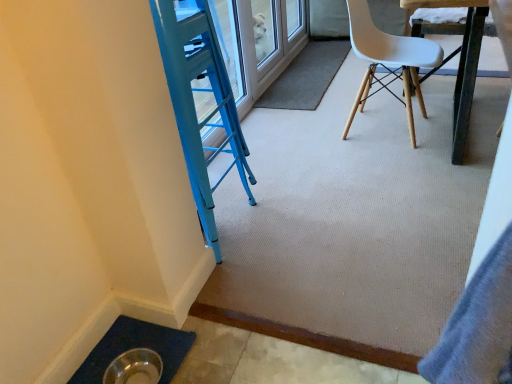
The width and height of the screenshot is (512, 384). Describe the element at coordinates (459, 62) in the screenshot. I see `metallic dark brown table at upper right` at that location.

I want to click on white plastic chair at upper right, so click(389, 60).

Considering the relative positions of metallic dark brown table at upper right and carpet at center in the image provided, is metallic dark brown table at upper right to the right of carpet at center from the viewer's perspective?

Indeed, metallic dark brown table at upper right is positioned on the right side of carpet at center.

You are a GUI agent. You are given a task and a screenshot of the screen. Output one action in this format:
    pyautogui.click(x=<x>, y=<y>)
    Task: Click on the table that is below the carpet at center (from the image's perspective)
    
    Given the screenshot: What is the action you would take?
    pyautogui.click(x=459, y=62)

Considering the positions of point (471, 44) and point (337, 68), is point (471, 44) closer or farther from the camera than point (337, 68)?

Point (471, 44) appears to be closer to the viewer than point (337, 68).

Who is shorter, metallic dark brown table at upper right or carpet at center?

carpet at center is shorter.

Is white plastic chair at upper right at the left side of metallic dark brown table at upper right?

Yes, white plastic chair at upper right is to the left of metallic dark brown table at upper right.

Is white plastic chair at upper right facing towards metallic dark brown table at upper right?

Yes, white plastic chair at upper right is aimed at metallic dark brown table at upper right.

At what (x,y) coordinates should I click in order to perform the action: click on table above the white plastic chair at upper right (from the image's perspective). Please return your answer as a coordinate pair (x, y). Image resolution: width=512 pixels, height=384 pixels. Looking at the image, I should click on (459, 62).

Is carpet at center in contact with white plastic chair at upper right?

No, carpet at center is not beside white plastic chair at upper right.

Does carpet at center have a greater height compared to white plastic chair at upper right?

No, carpet at center is not taller than white plastic chair at upper right.

Would you say carpet at center contains white plastic chair at upper right?

That's incorrect, white plastic chair at upper right is not inside carpet at center.

Which object is thinner, white plastic chair at upper right or carpet at center?

carpet at center.

From a real-world perspective, relative to carpet at center, is white plastic chair at upper right vertically above or below?

white plastic chair at upper right is above carpet at center.

Between white plastic chair at upper right and carpet at center, which one appears on the left side from the viewer's perspective?

carpet at center is more to the left.

What's the angular difference between metallic dark brown table at upper right and white plastic chair at upper right's facing directions?

metallic dark brown table at upper right and white plastic chair at upper right are facing 88.7 degrees away from each other.

Could white plastic chair at upper right be considered to be inside metallic dark brown table at upper right?

Absolutely, white plastic chair at upper right is inside metallic dark brown table at upper right.

Between metallic dark brown table at upper right and white plastic chair at upper right, which one has larger width?

Wider between the two is metallic dark brown table at upper right.

Identify the location of table in front of the white plastic chair at upper right. The width and height of the screenshot is (512, 384). (459, 62).

Is carpet at center shorter than metallic dark brown table at upper right?

Indeed, carpet at center has a lesser height compared to metallic dark brown table at upper right.

Is carpet at center thinner than metallic dark brown table at upper right?

Indeed, carpet at center has a lesser width compared to metallic dark brown table at upper right.

This screenshot has width=512, height=384. What are the coordinates of `mat to the left of metallic dark brown table at upper right` in the screenshot? It's located at (306, 76).

Which object is more forward, carpet at center or metallic dark brown table at upper right?

metallic dark brown table at upper right.

Identify the location of table on the right of carpet at center. (459, 62).

Where is `chair below the metallic dark brown table at upper right (from a real-world perspective)`? The height and width of the screenshot is (384, 512). chair below the metallic dark brown table at upper right (from a real-world perspective) is located at coordinates (389, 60).

Estimate the real-world distances between objects in this image. Which object is further from carpet at center, white plastic chair at upper right or metallic dark brown table at upper right?

The object further to carpet at center is metallic dark brown table at upper right.

Looking at the image, which one is located closer to metallic dark brown table at upper right, carpet at center or white plastic chair at upper right?

white plastic chair at upper right is positioned closer to the anchor metallic dark brown table at upper right.

Considering their positions, is metallic dark brown table at upper right positioned closer to white plastic chair at upper right than carpet at center?

metallic dark brown table at upper right lies closer to white plastic chair at upper right than the other object.

From the image, which object appears to be nearer to carpet at center, metallic dark brown table at upper right or white plastic chair at upper right?

white plastic chair at upper right is closer to carpet at center.

Looking at the image, which one is located closer to metallic dark brown table at upper right, white plastic chair at upper right or carpet at center?

white plastic chair at upper right is closer to metallic dark brown table at upper right.

Looking at this image, based on their spatial positions, is carpet at center or metallic dark brown table at upper right further from white plastic chair at upper right?

carpet at center is further to white plastic chair at upper right.

The height and width of the screenshot is (384, 512). In order to click on chair between metallic dark brown table at upper right and carpet at center in the front-back direction in this screenshot , I will do `click(389, 60)`.